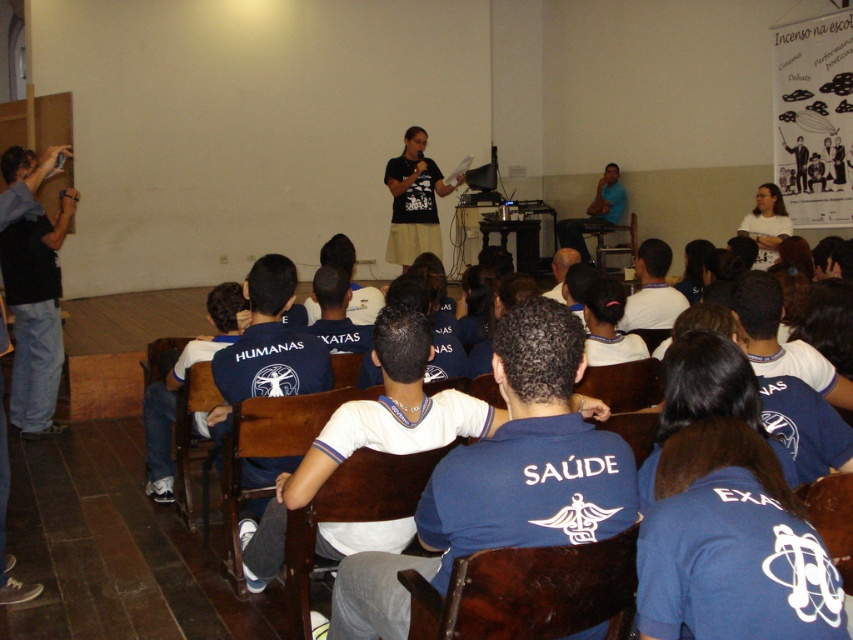
Is point (10, 252) closer to camera compared to point (598, 198)?

Yes, it is in front of point (598, 198).

This screenshot has height=640, width=853. What do you see at coordinates (35, 316) in the screenshot?
I see `black jeans at left` at bounding box center [35, 316].

Find the location of a particular element. The height and width of the screenshot is (640, 853). black jeans at left is located at coordinates (35, 316).

Does point (10, 419) lie in front of point (427, 209)?

Yes.

Does black jeans at left have a smaller size compared to black fabric shirt at center?

Correct, black jeans at left occupies less space than black fabric shirt at center.

Between point (7, 243) and point (433, 189), which one is positioned in front?

Positioned in front is point (7, 243).

Identify the location of black jeans at left. The width and height of the screenshot is (853, 640). (35, 316).

Can you confirm if black fabric shirt at center is positioned below blue shirt at upper center?

Yes.

Based on the photo, between black fabric shirt at center and blue shirt at upper center, which one appears on the left side from the viewer's perspective?

black fabric shirt at center

I want to click on black fabric shirt at center, so click(x=415, y=200).